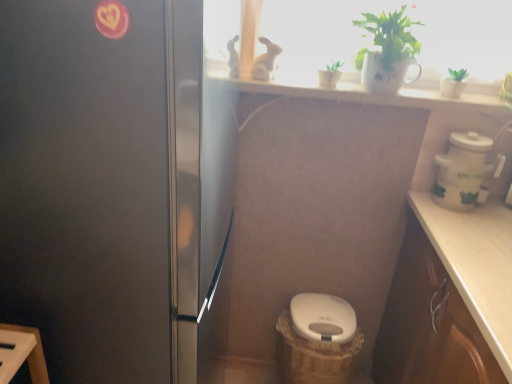
Locate an element on the screen. The image size is (512, 384). free point above white ceramic window sill at upper center (from a real-world perspective) is located at coordinates 372,90.